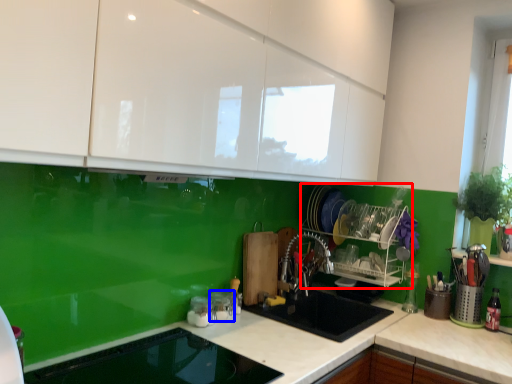
Question: Which object appears farthest to the camera in this image, appliance (highlighted by a red box) or appliance (highlighted by a blue box)?

Choices:
 (A) appliance
 (B) appliance

Answer: (A)